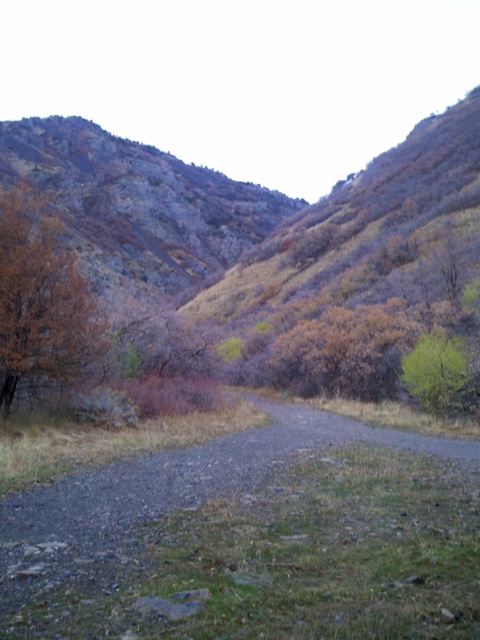
Between point (4, 413) and point (441, 388), which one is positioned behind?

Positioned behind is point (441, 388).

Is point (72, 253) closer to viewer compared to point (462, 344)?

Yes, point (72, 253) is closer to viewer.

Find the location of a particular element. This screenshot has width=480, height=640. orange-brown bark tree at left is located at coordinates (43, 305).

This screenshot has width=480, height=640. What are the coordinates of `orange-brown bark tree at left` in the screenshot? It's located at point(43,305).

Between gray gravel path at center and green leafy tree at center, which one has less height?

gray gravel path at center

Describe the element at coordinates (253, 540) in the screenshot. I see `gray gravel path at center` at that location.

In order to click on gray gravel path at center in this screenshot , I will do `click(253, 540)`.

Is gray gravel path at center taller than orange-brown bark tree at left?

Incorrect, gray gravel path at center's height is not larger of orange-brown bark tree at left's.

Is gray gravel path at center further to camera compared to orange-brown bark tree at left?

No, it is not.

Is point (332, 536) in front of point (70, 291)?

Yes.

I want to click on gray gravel path at center, so click(x=253, y=540).